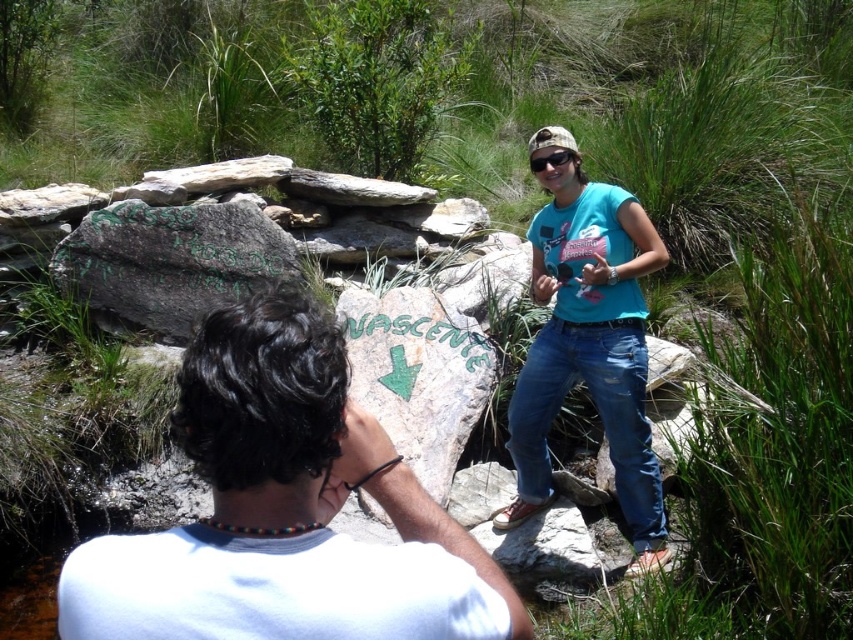
Question: Does white matte shirt at center have a lesser width compared to matte black goggles at upper center?

Choices:
 (A) yes
 (B) no

Answer: (B)

Question: Which point is closer to the camera?

Choices:
 (A) (573, 154)
 (B) (77, 625)
 (C) (598, 323)

Answer: (B)

Question: Is blue cotton t-shirt at center to the right of matte black goggles at upper center from the viewer's perspective?

Choices:
 (A) yes
 (B) no

Answer: (A)

Question: Does white matte shirt at center appear on the left side of matte black goggles at upper center?

Choices:
 (A) yes
 (B) no

Answer: (A)

Question: Which object is farther from the camera taking this photo?

Choices:
 (A) white matte shirt at center
 (B) matte black goggles at upper center

Answer: (B)

Question: Among these objects, which one is farthest from the camera?

Choices:
 (A) matte black goggles at upper center
 (B) white matte shirt at center
 (C) blue cotton t-shirt at center

Answer: (A)